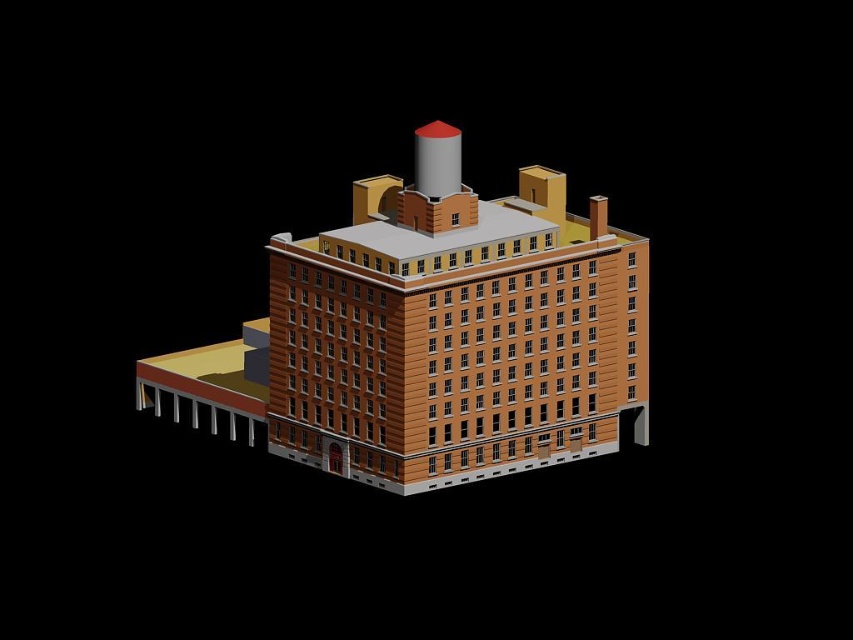
Question: Which of the following is the farthest from the observer?

Choices:
 (A) metallic silver chimney at upper center
 (B) brown brick building at center

Answer: (A)

Question: Is brown brick building at center thinner than metallic silver chimney at upper center?

Choices:
 (A) no
 (B) yes

Answer: (A)

Question: Which point is farther to the camera?

Choices:
 (A) (224, 406)
 (B) (445, 129)

Answer: (A)

Question: Considering the relative positions of brown brick building at center and metallic silver chimney at upper center in the image provided, where is brown brick building at center located with respect to metallic silver chimney at upper center?

Choices:
 (A) right
 (B) left

Answer: (B)

Question: Observing the image, what is the correct spatial positioning of brown brick building at center in reference to metallic silver chimney at upper center?

Choices:
 (A) right
 (B) left

Answer: (B)